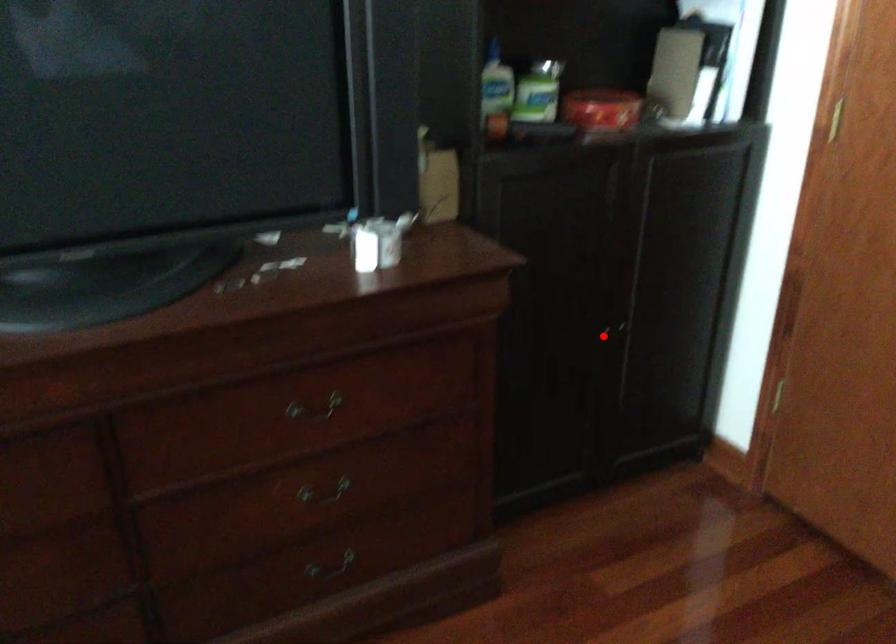
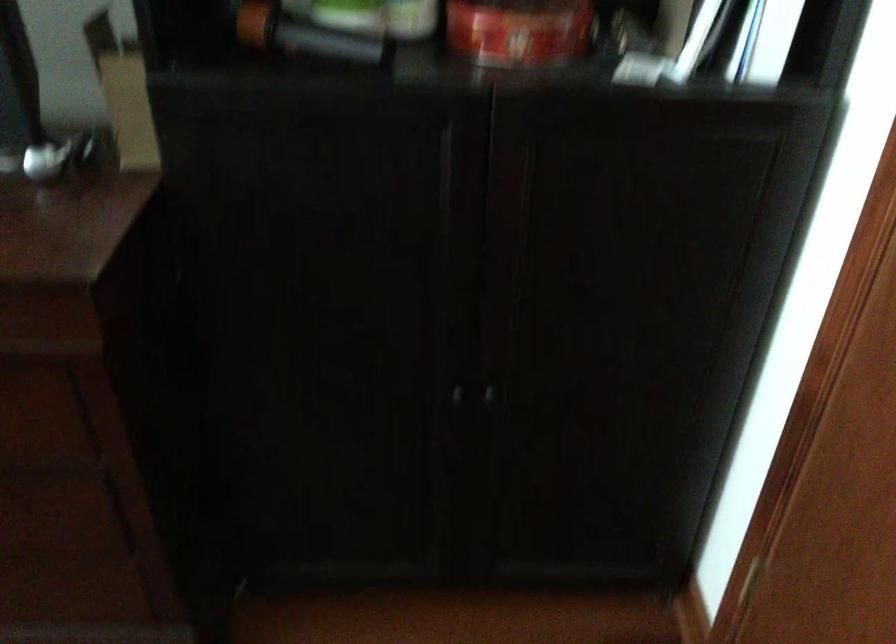
Where in the second image is the point corresponding to the highlighted location from the first image?

(457, 395)